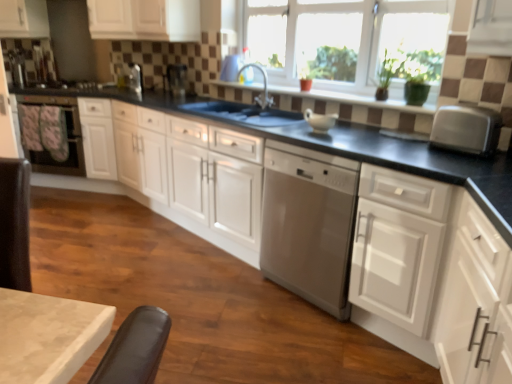
Locate an element on the screen. The image size is (512, 384). white matte cabinet at right, placed as the 1th cabinetry when sorted from right to left is located at coordinates (426, 268).

This screenshot has height=384, width=512. Describe the element at coordinates (264, 86) in the screenshot. I see `satin nickel faucet at center` at that location.

From the picture: How much space does white matte cabinet at upper left, which is the third cabinetry in right-to-left order, occupy horizontally?

It is 25.34 inches.

Measure the distance between satin silver toaster at upper center, the second appliance in the right-to-left sequence, and camera.

satin silver toaster at upper center, the second appliance in the right-to-left sequence, is 4.00 meters away from camera.

Describe the element at coordinates (353, 99) in the screenshot. I see `brown tile window sill at center` at that location.

This screenshot has height=384, width=512. Identify the location of metallic silver toaster at upper center, which is counted as the 3th appliance, starting from the left. (176, 79).

Between point (172, 91) and point (303, 51), which one is positioned in front?

Point (303, 51)

Which object is positioned more to the right, metallic silver toaster at upper center, which is counted as the 3th appliance, starting from the left, or clear glass window at upper center?

clear glass window at upper center.

Can you confirm if metallic silver toaster at upper center, arranged as the 1th appliance when viewed from the right, is wider than clear glass window at upper center?

Yes, metallic silver toaster at upper center, arranged as the 1th appliance when viewed from the right, is wider than clear glass window at upper center.

Does point (69, 115) come farther from viewer compared to point (440, 116)?

Yes, it is.

From the image's perspective, would you say matte black oven at left, placed as the 1th home appliance when sorted from back to front, is shown under silver metallic toaster at right?

Incorrect, from the image's perspective, matte black oven at left, placed as the 1th home appliance when sorted from back to front, is higher than silver metallic toaster at right.

Does matte black oven at left, placed as the 1th home appliance when sorted from back to front, appear on the left side of silver metallic toaster at right?

Indeed, matte black oven at left, placed as the 1th home appliance when sorted from back to front, is positioned on the left side of silver metallic toaster at right.

Is matte black oven at left, which is counted as the 2th home appliance, starting from the front, next to silver metallic toaster at right?

No, matte black oven at left, which is counted as the 2th home appliance, starting from the front, is not next to silver metallic toaster at right.

From a real-world perspective, which object rests below the other?

satin silver dishwasher at center, the second home appliance positioned from the left.

Which of these two, green matte plant at upper center or satin silver dishwasher at center, the second home appliance positioned from the left, stands taller?

Standing taller between the two is satin silver dishwasher at center, the second home appliance positioned from the left.

Is green matte plant at upper center in contact with satin silver dishwasher at center, which is the first home appliance in front-to-back order?

No, green matte plant at upper center is not next to satin silver dishwasher at center, which is the first home appliance in front-to-back order.

Which of these two, black matte stove at left or metallic silver toaster at upper center, arranged as the 1th appliance when viewed from the right, is wider?

Wider between the two is black matte stove at left.

Between black matte stove at left and metallic silver toaster at upper center, which appears as the third appliance when viewed from the back, which one has larger size?

Bigger between the two is black matte stove at left.

Could you tell me if black matte stove at left is turned towards metallic silver toaster at upper center, arranged as the 1th appliance when viewed from the right?

No, black matte stove at left is not facing towards metallic silver toaster at upper center, arranged as the 1th appliance when viewed from the right.

Is white matte cabinet at right, the fourth cabinetry positioned from the left, positioned with its back to satin silver dishwasher at center, arranged as the second home appliance when viewed from the back?

No.

From a real-world perspective, which object rests below the other?

satin silver dishwasher at center, arranged as the second home appliance when viewed from the back, from a real-world perspective.

Identify the location of the 1st home appliance above the white matte cabinet at right, placed as the 1th cabinetry when sorted from right to left (from the image's perspective). (308, 224).

Which is in front, white matte cabinet at right, placed as the 1th cabinetry when sorted from right to left, or satin silver dishwasher at center, arranged as the second home appliance when viewed from the back?

white matte cabinet at right, placed as the 1th cabinetry when sorted from right to left, is in front.

From a real-world perspective, is green matte plant at upper center physically above satin silver toaster at upper center, marked as the second appliance in a front-to-back arrangement?

Correct, in the physical world, green matte plant at upper center is higher than satin silver toaster at upper center, marked as the second appliance in a front-to-back arrangement.

Which of these two, green matte plant at upper center or satin silver toaster at upper center, marked as the second appliance in a front-to-back arrangement, is thinner?

satin silver toaster at upper center, marked as the second appliance in a front-to-back arrangement.

How many degrees apart are the facing directions of green matte plant at upper center and satin silver toaster at upper center, which is the second appliance in left-to-right order?

green matte plant at upper center and satin silver toaster at upper center, which is the second appliance in left-to-right order, are facing 9.17 degrees away from each other.

Would you say green matte plant at upper center contains satin silver toaster at upper center, marked as the second appliance in a front-to-back arrangement?

No, satin silver toaster at upper center, marked as the second appliance in a front-to-back arrangement, is not surrounded by green matte plant at upper center.

Considering the sizes of objects metallic silver toaster at upper center, arranged as the 1th appliance when viewed from the right, and satin silver toaster at upper center, the second appliance when ordered from back to front, in the image provided, who is shorter, metallic silver toaster at upper center, arranged as the 1th appliance when viewed from the right, or satin silver toaster at upper center, the second appliance when ordered from back to front,?

satin silver toaster at upper center, the second appliance when ordered from back to front.

From a real-world perspective, is metallic silver toaster at upper center, the first appliance when ordered from front to back, beneath satin silver toaster at upper center, marked as the second appliance in a front-to-back arrangement?

No, from a real-world perspective, metallic silver toaster at upper center, the first appliance when ordered from front to back, is not below satin silver toaster at upper center, marked as the second appliance in a front-to-back arrangement.

Considering their positions, is metallic silver toaster at upper center, which is counted as the 3th appliance, starting from the left, located in front of or behind satin silver toaster at upper center, which is the second appliance in left-to-right order?

Clearly, metallic silver toaster at upper center, which is counted as the 3th appliance, starting from the left, is in front of satin silver toaster at upper center, which is the second appliance in left-to-right order.

Identify the location of appliance lying below the clear glass window at upper center (from the image's perspective). [176, 79].

You are a GUI agent. You are given a task and a screenshot of the screen. Output one action in this format:
    pyautogui.click(x=<x>, y=<y>)
    Task: Click on the 2nd home appliance behind when counting from the silver metallic toaster at right
    The height and width of the screenshot is (384, 512).
    Given the screenshot: What is the action you would take?
    pyautogui.click(x=64, y=136)

From the image, which object appears to be nearer to satin silver dishwasher at center, the second home appliance positioned from the left, white glossy cabinets at center, which is the third cabinetry in left-to-right order, or clear glass window at upper center?

white glossy cabinets at center, which is the third cabinetry in left-to-right order, is positioned closer to the anchor satin silver dishwasher at center, the second home appliance positioned from the left.

Looking at this image, estimate the real-world distances between objects in this image. Which object is further from satin silver toaster at upper center, marked as the second appliance in a front-to-back arrangement, white matte cabinet at upper left, which is the third cabinetry in right-to-left order, or metallic silver toaster at upper center, which appears as the third appliance when viewed from the back?

Based on the image, white matte cabinet at upper left, which is the third cabinetry in right-to-left order, appears to be further to satin silver toaster at upper center, marked as the second appliance in a front-to-back arrangement.

From the image, which object appears to be nearer to black matte stove at left, brown tile window sill at center or white matte cabinet at right, placed as the 1th cabinetry when sorted from right to left?

brown tile window sill at center is closer to black matte stove at left.

Estimate the real-world distances between objects in this image. Which object is further from silver metallic toaster at right, clear glass window at upper center or satin silver toaster at upper center, the second appliance when ordered from back to front?

The object further to silver metallic toaster at right is satin silver toaster at upper center, the second appliance when ordered from back to front.

From the picture: Based on their spatial positions, is matte black oven at left, which is counted as the 2th home appliance, starting from the front, or satin silver toaster at upper center, the second appliance when ordered from back to front, closer to white matte cabinet at upper left, which is the third cabinetry in right-to-left order?

satin silver toaster at upper center, the second appliance when ordered from back to front, lies closer to white matte cabinet at upper left, which is the third cabinetry in right-to-left order, than the other object.

When comparing their distances from white matte cabinet at upper left, which is the third cabinetry in right-to-left order, does brown tile window sill at center or matte black oven at left, the second home appliance positioned from the right, seem further?

The object further to white matte cabinet at upper left, which is the third cabinetry in right-to-left order, is matte black oven at left, the second home appliance positioned from the right.

When comparing their distances from metallic silver toaster at upper center, the first appliance when ordered from front to back, does black matte stove at left or satin nickel faucet at center seem closer?

satin nickel faucet at center lies closer to metallic silver toaster at upper center, the first appliance when ordered from front to back, than the other object.

When comparing their distances from satin silver toaster at upper center, the second appliance when ordered from back to front, does black matte stove at left or white glossy cabinets at center, which is the third cabinetry in left-to-right order, seem further?

Among the two, white glossy cabinets at center, which is the third cabinetry in left-to-right order, is located further to satin silver toaster at upper center, the second appliance when ordered from back to front.

I want to click on kitchen appliance between white matte cabinet at right, placed as the 1th cabinetry when sorted from right to left, and satin nickel faucet at center from front to back, so click(466, 129).

You are a GUI agent. You are given a task and a screenshot of the screen. Output one action in this format:
    pyautogui.click(x=<x>, y=<y>)
    Task: Click on the stove between white matte cabinet at upper left, which is the first cabinetry in left-to-right order, and satin silver toaster at upper center, the second appliance when ordered from back to front
    The height and width of the screenshot is (384, 512).
    Given the screenshot: What is the action you would take?
    pyautogui.click(x=71, y=89)

Where is `stove between brushed metal toaster at upper left, the 1th appliance viewed from the left, and green matte plant at upper center, in the horizontal direction`? This screenshot has width=512, height=384. stove between brushed metal toaster at upper left, the 1th appliance viewed from the left, and green matte plant at upper center, in the horizontal direction is located at coordinates (71, 89).

Where is `home appliance between brushed metal toaster at upper left, which is the 3th appliance from front to back, and metallic silver toaster at upper center, the first appliance when ordered from front to back, from left to right`? The height and width of the screenshot is (384, 512). home appliance between brushed metal toaster at upper left, which is the 3th appliance from front to back, and metallic silver toaster at upper center, the first appliance when ordered from front to back, from left to right is located at coordinates (64, 136).